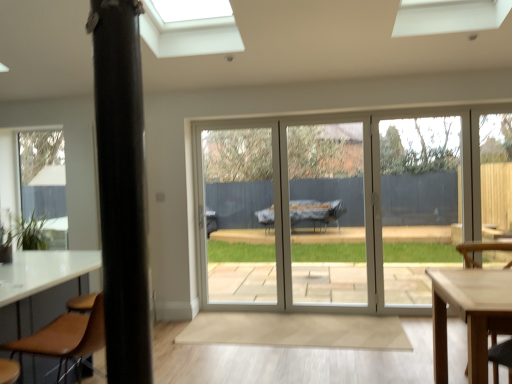
Question: Is brown leather chair at lower left, which ranks as the first chair in left-to-right order, thinner than black matte pole at left?

Choices:
 (A) yes
 (B) no

Answer: (B)

Question: Is the depth of brown leather chair at lower left, which is the 2th chair from right to left, greater than that of black matte pole at left?

Choices:
 (A) no
 (B) yes

Answer: (B)

Question: Is brown leather chair at lower left, which ranks as the 1th chair in front-to-back order, to the left of black matte pole at left from the viewer's perspective?

Choices:
 (A) no
 (B) yes

Answer: (B)

Question: From the image's perspective, does brown leather chair at lower left, which ranks as the first chair in left-to-right order, appear higher than black matte pole at left?

Choices:
 (A) yes
 (B) no

Answer: (B)

Question: Are brown leather chair at lower left, which ranks as the 1th chair in front-to-back order, and black matte pole at left making contact?

Choices:
 (A) no
 (B) yes

Answer: (A)

Question: From a real-world perspective, is brown leather chair at lower left, the 2th chair when ordered from back to front, below black matte pole at left?

Choices:
 (A) yes
 (B) no

Answer: (A)

Question: Is wooden chair at lower right, which is the 2th chair from front to back, oriented towards brown leather chair at lower left, which ranks as the first chair in left-to-right order?

Choices:
 (A) yes
 (B) no

Answer: (B)

Question: Does wooden chair at lower right, which appears as the 1th chair when viewed from the back, lie in front of brown leather chair at lower left, the 2th chair when ordered from back to front?

Choices:
 (A) yes
 (B) no

Answer: (B)

Question: Are wooden chair at lower right, which is the 2th chair from front to back, and brown leather chair at lower left, which ranks as the 1th chair in front-to-back order, located far from each other?

Choices:
 (A) no
 (B) yes

Answer: (B)

Question: Considering the relative positions of wooden chair at lower right, which is the 2th chair from front to back, and brown leather chair at lower left, which is the 2th chair from right to left, in the image provided, is wooden chair at lower right, which is the 2th chair from front to back, to the right of brown leather chair at lower left, which is the 2th chair from right to left, from the viewer's perspective?

Choices:
 (A) no
 (B) yes

Answer: (B)

Question: From a real-world perspective, does wooden chair at lower right, the second chair viewed from the left, sit lower than brown leather chair at lower left, which ranks as the first chair in left-to-right order?

Choices:
 (A) yes
 (B) no

Answer: (A)

Question: Does wooden chair at lower right, which is the 2th chair from front to back, appear on the left side of brown leather chair at lower left, which ranks as the first chair in left-to-right order?

Choices:
 (A) yes
 (B) no

Answer: (B)

Question: From the image's perspective, is green matte plant at lower left beneath wooden chair at lower right, the second chair viewed from the left?

Choices:
 (A) no
 (B) yes

Answer: (A)